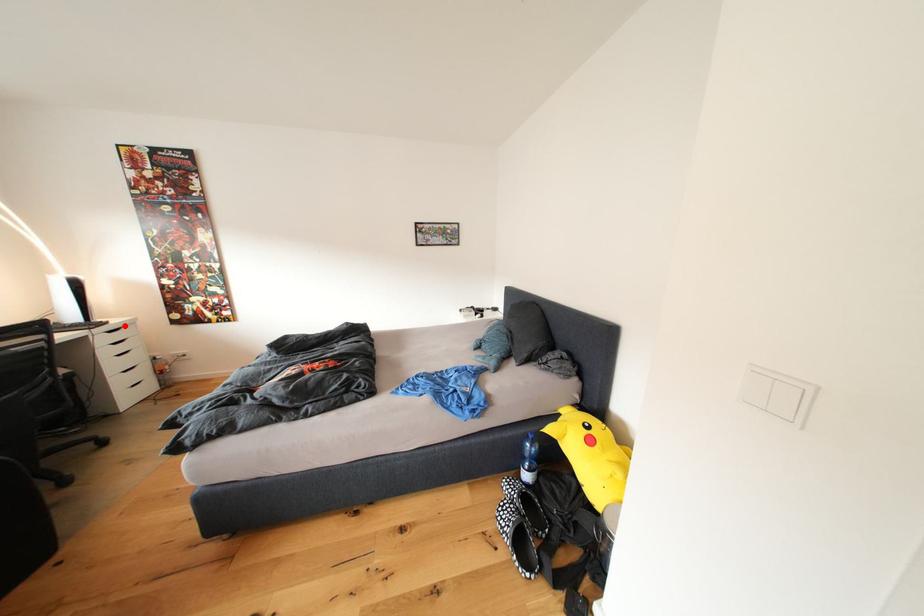
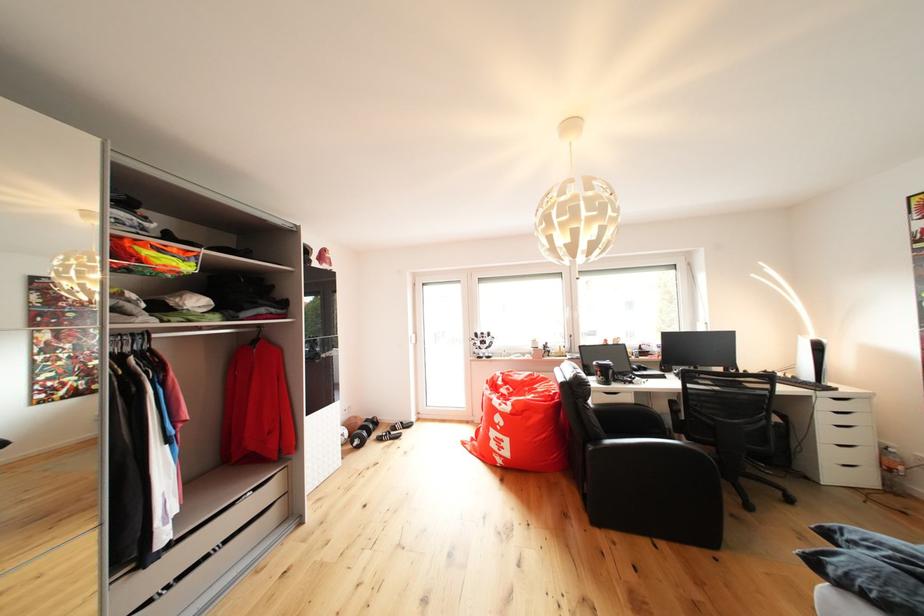
Find the pixel in the second image that matches the highlighted location in the first image.

(855, 395)